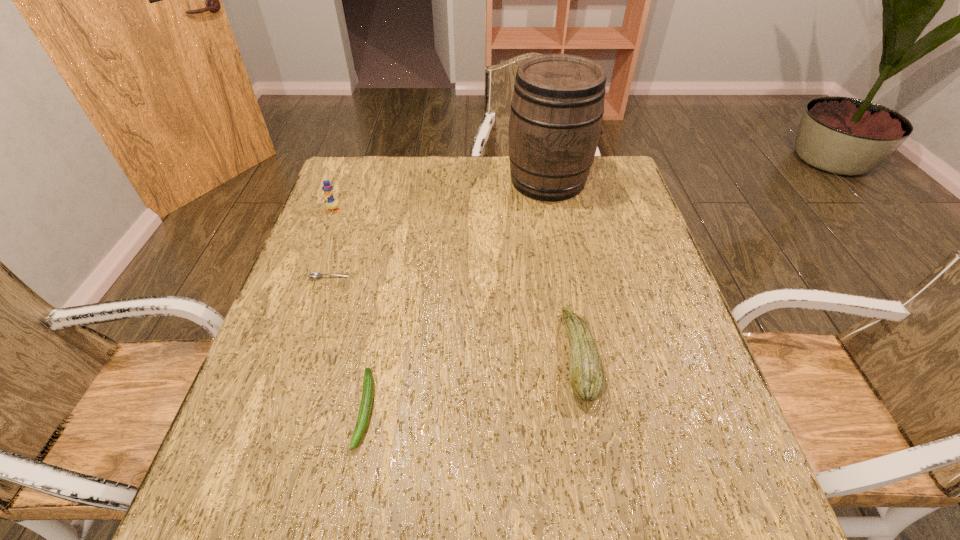
Where is `wine bucket`? This screenshot has width=960, height=540. wine bucket is located at coordinates (557, 107).

The image size is (960, 540). Find the location of `the farthest object`. the farthest object is located at coordinates (557, 107).

Find the location of a particular element. the second tallest object is located at coordinates (x=331, y=203).

Locate an element on the screen. duckling is located at coordinates (331, 203).

This screenshot has width=960, height=540. I want to click on the third shortest object, so click(x=587, y=377).

The height and width of the screenshot is (540, 960). I want to click on the right zucchini, so click(587, 377).

The height and width of the screenshot is (540, 960). Find the location of `the left zucchini`. the left zucchini is located at coordinates (365, 408).

At what (x,y) coordinates should I click in order to perform the action: click on the third object from right to left. Please return your answer as a coordinate pair (x, y). Looking at the image, I should click on (365, 408).

This screenshot has width=960, height=540. I want to click on the third nearest object, so (316, 275).

Identify the location of the shortest object. (316, 275).